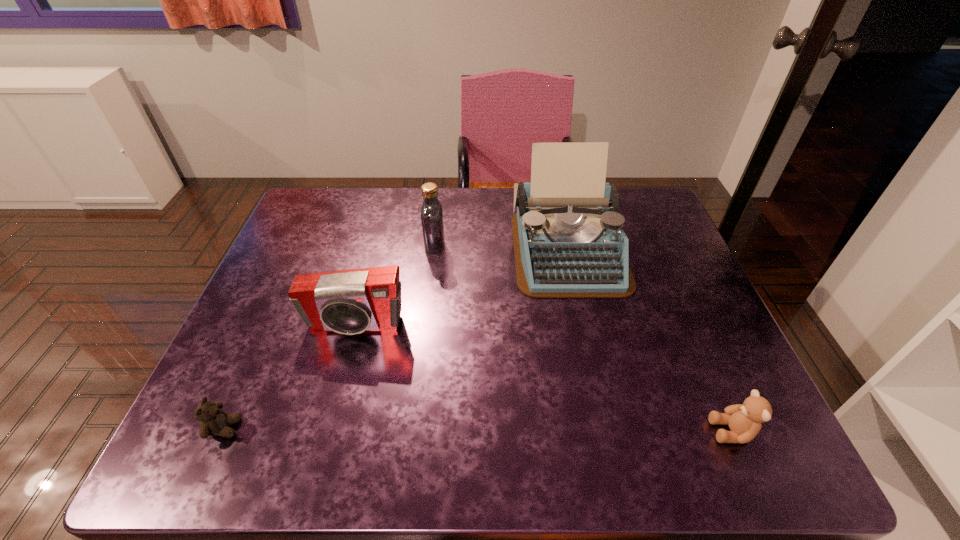
Where is `typewriter that is at the right edge`? The image size is (960, 540). typewriter that is at the right edge is located at coordinates (568, 240).

Locate an element on the screen. The height and width of the screenshot is (540, 960). teddy bear that is at the right edge is located at coordinates (744, 420).

Find the location of a particular element. object located at the near left corner is located at coordinates (214, 421).

Where is `object that is at the far right corner`? This screenshot has height=540, width=960. object that is at the far right corner is located at coordinates (568, 240).

The image size is (960, 540). I want to click on object located in the near right corner section of the desktop, so click(x=744, y=420).

Find the location of a particular element. This screenshot has width=960, height=540. vacant space at the far edge is located at coordinates (471, 200).

Locate an element on the screen. free space at the near edge of the desktop is located at coordinates (445, 431).

Find the location of `free space at the left edge of the desktop`. free space at the left edge of the desktop is located at coordinates tap(266, 351).

In the image, there is a desktop. Identify the location of free space at the right edge. The height and width of the screenshot is (540, 960). (651, 289).

Where is `vacant space at the far left corner of the desktop`? The image size is (960, 540). vacant space at the far left corner of the desktop is located at coordinates (339, 202).